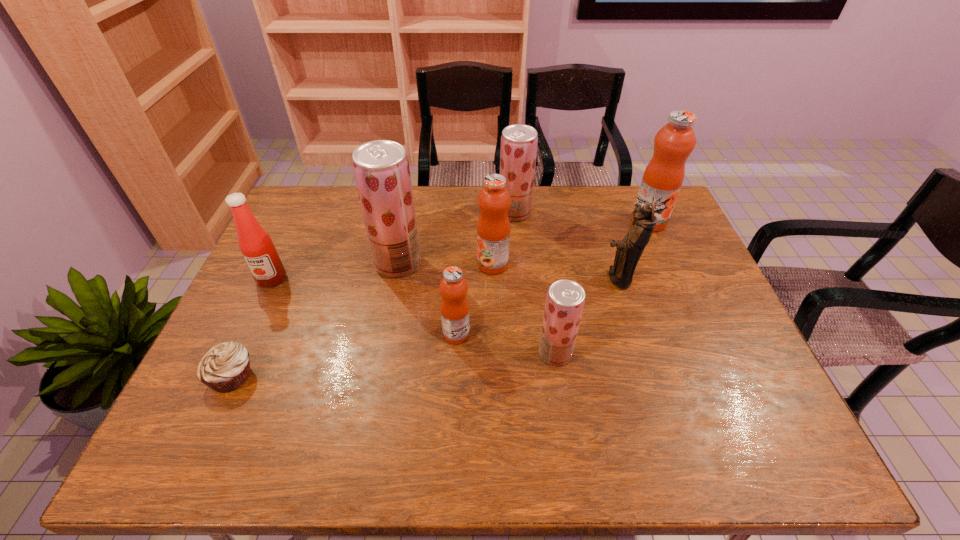
This screenshot has width=960, height=540. Find the location of `orange fruit juice that stands as the third closest to the muffin`. orange fruit juice that stands as the third closest to the muffin is located at coordinates (663, 177).

You are a GUI agent. You are given a task and a screenshot of the screen. Output one action in this format:
    pyautogui.click(x=<x>, y=<y>)
    Task: Click on the vacant space that satisfies the following two spatial constraints: 1. on the front-facing side of the shortest object; 2. on the left side of the condiment
    
    Given the screenshot: What is the action you would take?
    tap(226, 376)

In order to click on vacant position in the image that satisfies the following two spatial constraints: 1. on the front label of the farthest orange fruit juice; 2. on the front label of the second nearest orange fruit juice in this screenshot , I will do `click(667, 264)`.

Locate an element on the screen. Image resolution: width=960 pixels, height=540 pixels. free space that satisfies the following two spatial constraints: 1. on the front-facing side of the red condiment; 2. on the left side of the shortest object is located at coordinates (226, 376).

Identify the location of free space that satisfies the following two spatial constraints: 1. on the front label of the smallest strawberry fruit juice; 2. on the left side of the fifth fruit juice from right to left. (455, 353).

This screenshot has height=540, width=960. In order to click on vacant space that satisfies the following two spatial constraints: 1. on the front label of the smallest strawberry fruit juice; 2. on the right side of the leftmost orange fruit juice in this screenshot , I will do `click(455, 353)`.

Identify the location of free spot that satisfies the following two spatial constraints: 1. on the front label of the second orange fruit juice from right to left; 2. on the back side of the smallest strawberry fruit juice. The image size is (960, 540). (495, 353).